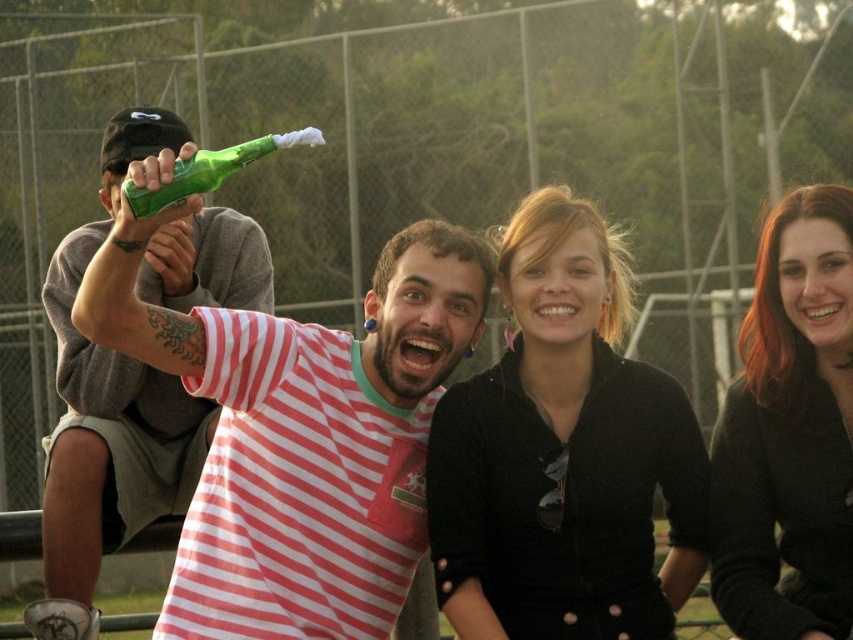
You are organizing a charity event and need to decide which of the two black garments, the black matte jacket at center or the smooth black sweater at right, can accommodate a larger embroidered logo on its front without looking crowded. Based on their sizes, which one would you choose?

The black matte jacket at center has a larger width than the smooth black sweater at right, so it can accommodate a larger embroidered logo without appearing crowded.

You are standing at the center of the image. Which direction should you move to reach the green matte bottle at left?

The green matte bottle at left is located at point (x=105, y=451), which is to the left side of the image. Therefore, you should move to the left to reach it.

In the scene, there are two people wearing black clothing. One is wearing a black matte jacket at center and the other a smooth black sweater at right. From the photographer s perspective, which one is positioned to the left?

The black matte jacket at center is positioned to the left of the smooth black sweater at right.